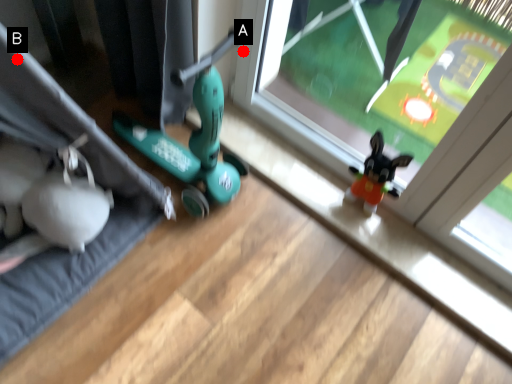
Question: Two points are circled on the image, labeled by A and B beside each circle. Which point is further to the camera?

Choices:
 (A) A is further
 (B) B is further

Answer: (A)